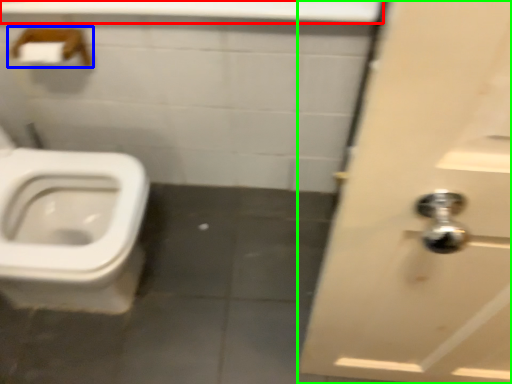
Question: Based on their relative distances, which object is nearer to counter top (highlighted by a red box)? Choose from towel bar (highlighted by a blue box) and door (highlighted by a green box).

Choices:
 (A) towel bar
 (B) door

Answer: (A)